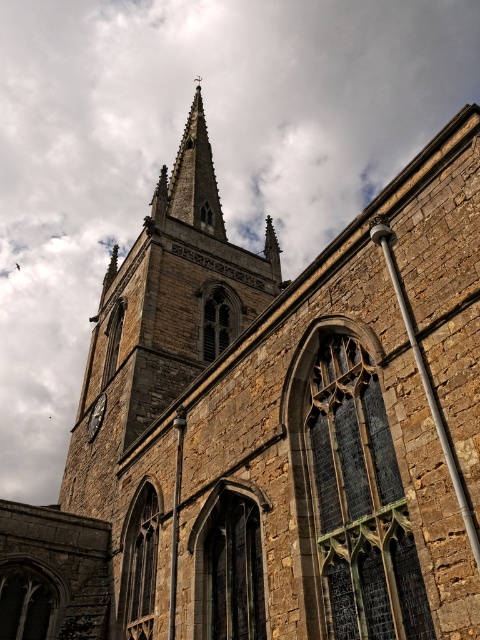
Question: In this image, where is smooth stone spire at center located relative to matte gray clock at lower left?

Choices:
 (A) above
 (B) below

Answer: (A)

Question: Among these points, which one is farthest from the camera?

Choices:
 (A) (226, 312)
 (B) (105, 403)

Answer: (A)

Question: Considering the real-world distances, which object is farthest from the smooth stone spire at center?

Choices:
 (A) matte gray clock at lower left
 (B) stone steeple at center

Answer: (A)

Question: Which object is positioned closest to the smooth stone spire at center?

Choices:
 (A) matte gray clock at lower left
 (B) stone steeple at center

Answer: (B)

Question: Does stone steeple at center appear on the left side of smooth stone spire at center?

Choices:
 (A) no
 (B) yes

Answer: (A)

Question: Is stone steeple at center further to camera compared to smooth stone spire at center?

Choices:
 (A) no
 (B) yes

Answer: (A)